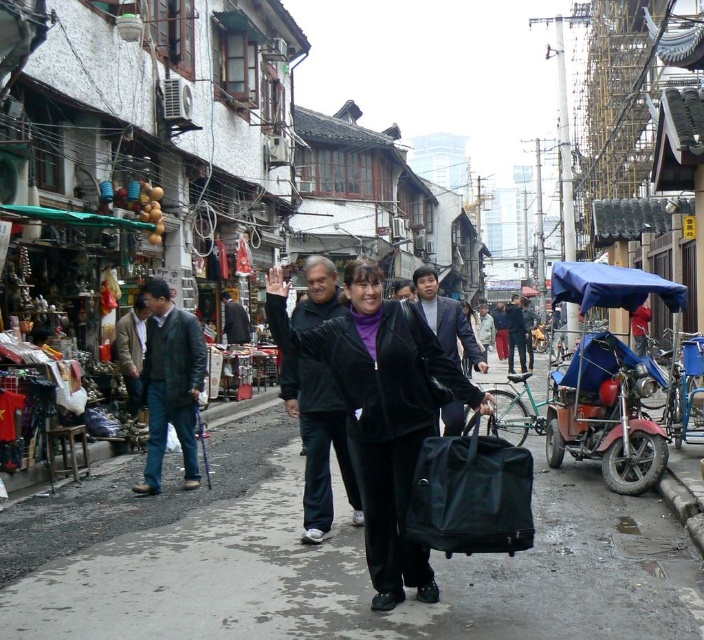
You are a delivery person carrying a package that is 1.5 meters tall. You need to pass through the narrow street in the market area shown. The street has a black velvety jacket at center and a black leather bag at center displayed on the stalls. Will your package fit vertically between these two items?

The black velvety jacket at center is much taller than the black leather bag at center. Since your package is 1.5 meters tall, it may not fit vertically between them if the space between the two items is less than 1.5 meters. However, the exact height difference isn

You are a street vendor setting up a stall in the market. You have two jackets to display on a narrow shelf. The dark brown leather jacket at left and the dark gray jacket at center. Given the shelf space is limited, which jacket should you place first to maximize the number of items displayed?

You should place the dark brown leather jacket at left first because it has a lesser width compared to the dark gray jacket at center, allowing more items to fit on the shelf.

Consider the image. You are a delivery person standing at the entrance of the market. You need to pick up a package from the black velvety jacket at center and deliver it to the black leather bag at center. Which object should you approach first based on their positions?

You should approach the black velvety jacket at center first since it is closer to you than the black leather bag at center, which is further away.